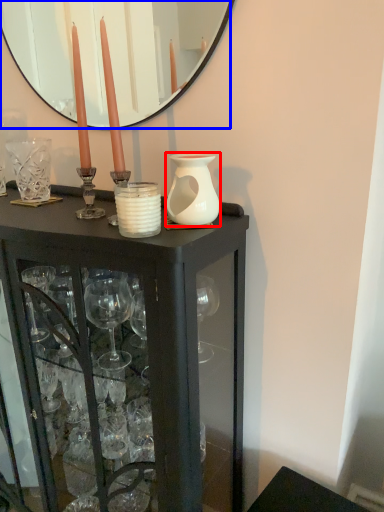
Question: Which object appears farthest to the camera in this image, vase (highlighted by a red box) or mirror (highlighted by a blue box)?

Choices:
 (A) vase
 (B) mirror

Answer: (B)